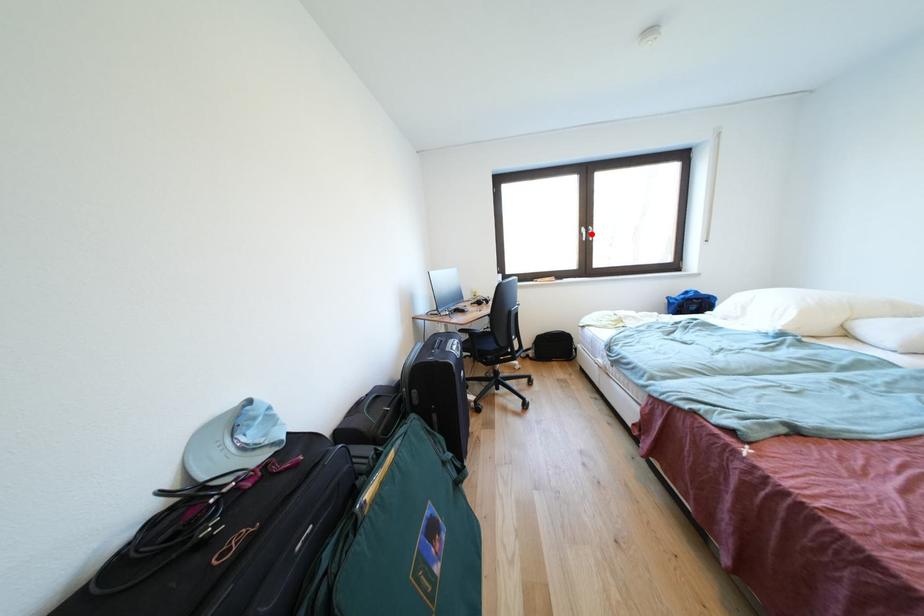
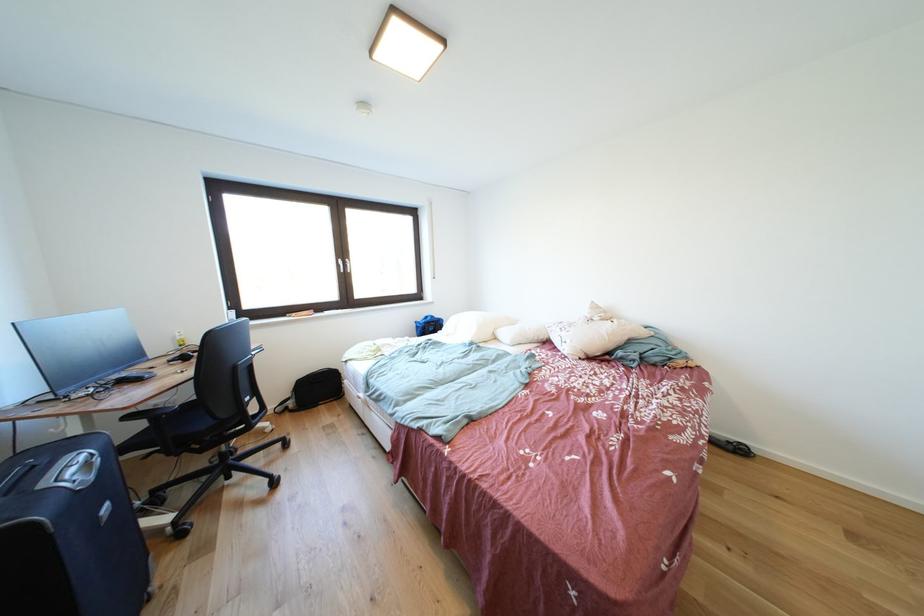
Locate, in the second image, the point that corresponds to the highlighted location in the first image.

(348, 265)